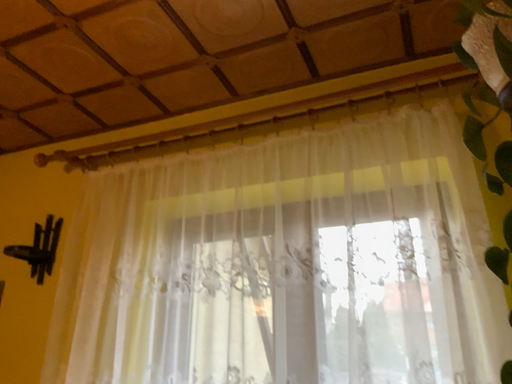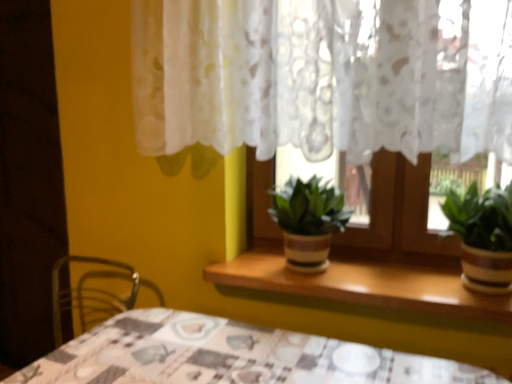
Question: How did the camera likely rotate when shooting the video?

Choices:
 (A) rotated downward
 (B) rotated upward

Answer: (A)